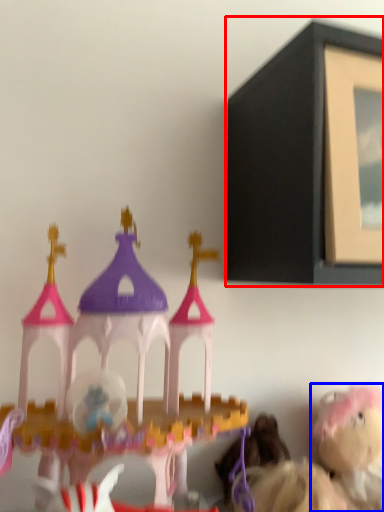
Question: Which object appears farthest to the camera in this image, picture frame (highlighted by a red box) or toy (highlighted by a blue box)?

Choices:
 (A) picture frame
 (B) toy

Answer: (B)